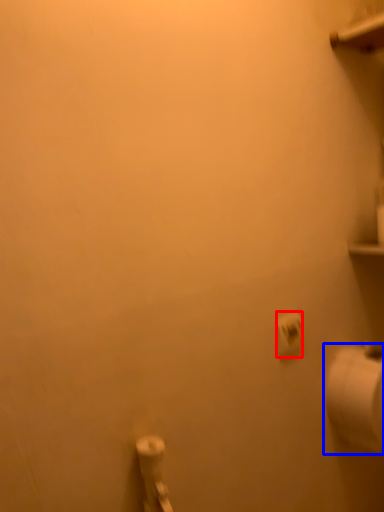
Question: Which object appears farthest to the camera in this image, toilet paper (highlighted by a red box) or toilet paper (highlighted by a blue box)?

Choices:
 (A) toilet paper
 (B) toilet paper

Answer: (B)